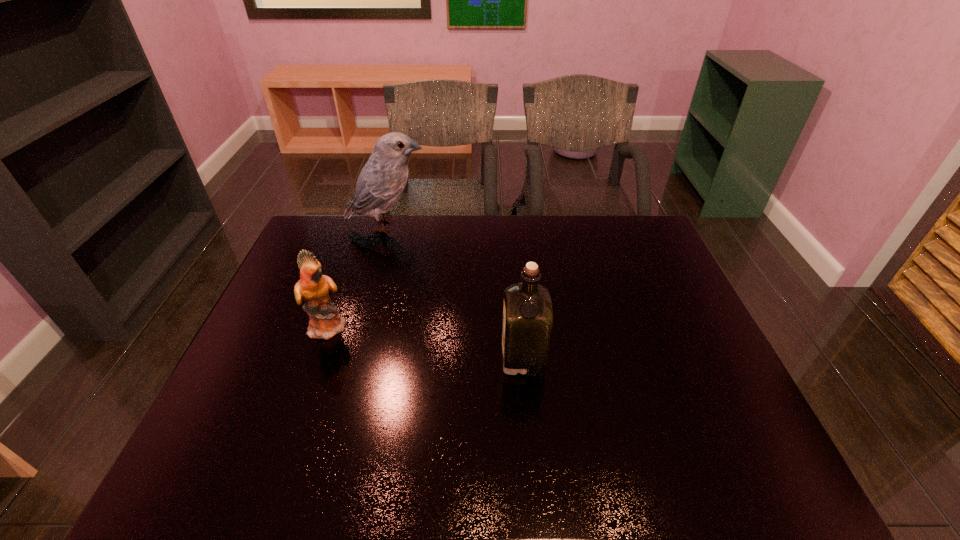
Locate an element on the screen. object that is at the far left corner is located at coordinates (381, 181).

The height and width of the screenshot is (540, 960). In order to click on vacant space at the far edge of the desktop in this screenshot , I will do `click(483, 225)`.

This screenshot has width=960, height=540. In order to click on vacant space at the near edge of the desktop in this screenshot , I will do [x=311, y=456].

Locate an element on the screen. Image resolution: width=960 pixels, height=540 pixels. blank space at the left edge of the desktop is located at coordinates (263, 375).

Locate an element on the screen. free space at the right edge of the desktop is located at coordinates (668, 337).

In the image, there is a desktop. Identify the location of vacant area at the far left corner. (313, 227).

This screenshot has height=540, width=960. Identify the location of free space at the near right corner of the desktop. [x=716, y=473].

The width and height of the screenshot is (960, 540). I want to click on vacant space that's between the rightmost object and the nearer parrot, so click(426, 341).

Identify the location of vacant space in between the nearer parrot and the rightmost object. (426, 341).

Find the location of a particular element. The width and height of the screenshot is (960, 540). empty space between the liquor and the farthest object is located at coordinates (455, 291).